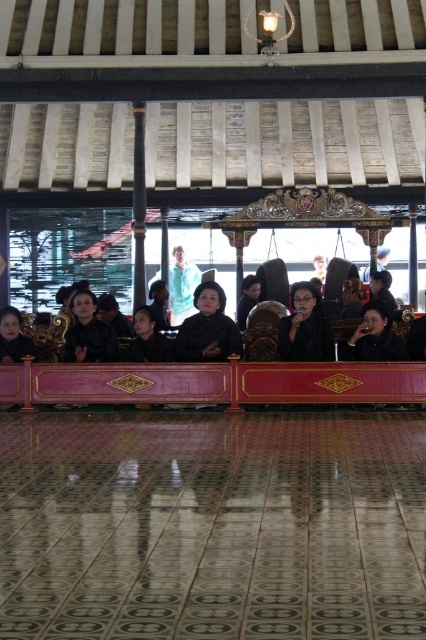
Does matte black jacket at lower right have a lesser height compared to light blue fabric at center?

Yes, matte black jacket at lower right is shorter than light blue fabric at center.

Is matte black jacket at lower right closer to the viewer compared to light blue fabric at center?

Yes, matte black jacket at lower right is closer to the viewer.

In order to click on matte black jacket at lower right in this screenshot , I will do `click(374, 337)`.

Does black matte jacket at center have a greater height compared to light blue fabric at center?

Incorrect, black matte jacket at center's height is not larger of light blue fabric at center's.

Find the location of a particular element. This screenshot has height=640, width=426. black matte jacket at center is located at coordinates (305, 326).

Can you confirm if matte black jacket at lower right is positioned to the right of black glossy hair at center?

Correct, you'll find matte black jacket at lower right to the right of black glossy hair at center.

At what (x,y) coordinates should I click in order to perform the action: click on matte black jacket at lower right. Please return your answer as a coordinate pair (x, y). Looking at the image, I should click on (374, 337).

Find the location of a particular element. This screenshot has width=426, height=640. matte black jacket at lower right is located at coordinates (374, 337).